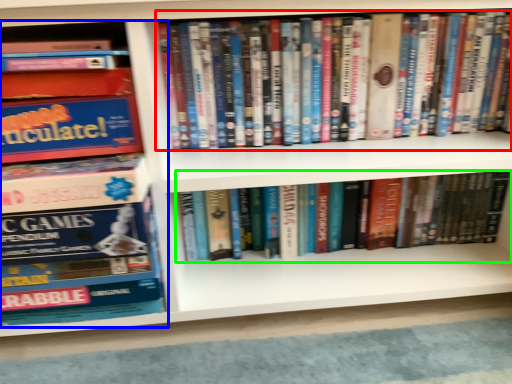
Question: Estimate the real-world distances between objects in this image. Which object is farther from book (highlighted by a red box), book (highlighted by a blue box) or book (highlighted by a green box)?

Choices:
 (A) book
 (B) book

Answer: (A)